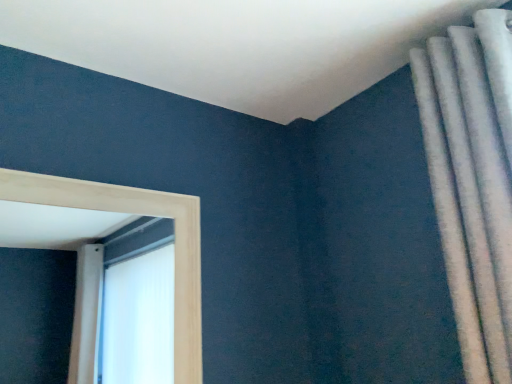
Question: Is light wood frame at left positioned far away from white textured curtain at upper right?

Choices:
 (A) no
 (B) yes

Answer: (A)

Question: Is the depth of light wood frame at left greater than that of white textured curtain at upper right?

Choices:
 (A) yes
 (B) no

Answer: (A)

Question: From the image's perspective, is light wood frame at left located above white textured curtain at upper right?

Choices:
 (A) no
 (B) yes

Answer: (A)

Question: Is light wood frame at left not within white textured curtain at upper right?

Choices:
 (A) yes
 (B) no

Answer: (A)

Question: From the image's perspective, would you say light wood frame at left is shown under white textured curtain at upper right?

Choices:
 (A) no
 (B) yes

Answer: (B)

Question: Is light wood frame at left at the right side of white textured curtain at upper right?

Choices:
 (A) no
 (B) yes

Answer: (A)

Question: Can you confirm if white textured curtain at upper right is thinner than light wood frame at left?

Choices:
 (A) yes
 (B) no

Answer: (B)

Question: Is white textured curtain at upper right aimed at light wood frame at left?

Choices:
 (A) no
 (B) yes

Answer: (A)

Question: Is white textured curtain at upper right positioned behind light wood frame at left?

Choices:
 (A) yes
 (B) no

Answer: (B)

Question: Can you confirm if white textured curtain at upper right is smaller than light wood frame at left?

Choices:
 (A) no
 (B) yes

Answer: (A)

Question: Does white textured curtain at upper right have a greater height compared to light wood frame at left?

Choices:
 (A) yes
 (B) no

Answer: (A)

Question: Can light wood frame at left be found inside white textured curtain at upper right?

Choices:
 (A) yes
 (B) no

Answer: (B)

Question: Considering their positions, is white textured curtain at upper right located in front of or behind light wood frame at left?

Choices:
 (A) front
 (B) behind

Answer: (A)